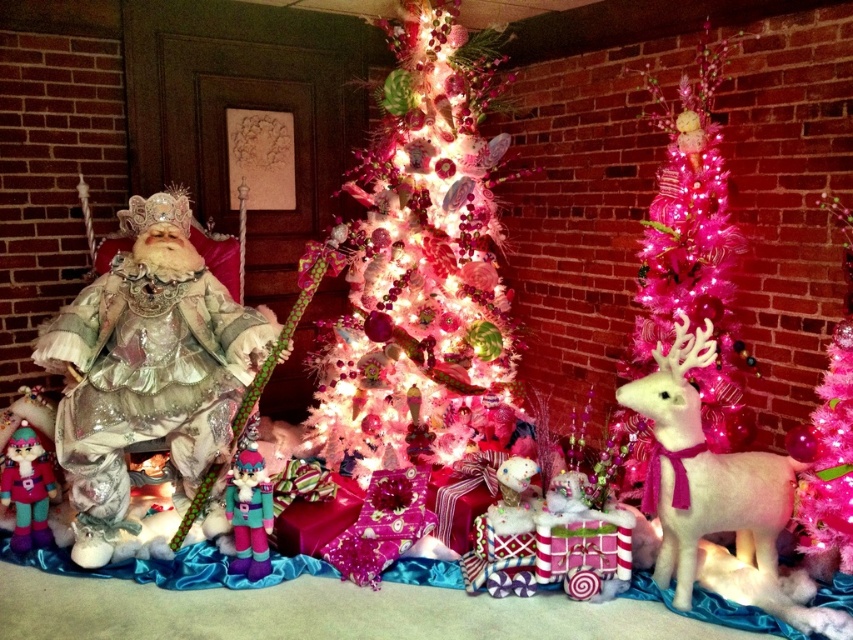
Question: Estimate the real-world distances between objects in this image. Which object is farther from the velvet plush nutcracker at lower left?

Choices:
 (A) shiny silver doll at left
 (B) white glittery christmas tree at center
 (C) pink glittery christmas tree at right

Answer: (C)

Question: Can you confirm if shiny silver doll at left is thinner than pink tinsel christmas tree at right?

Choices:
 (A) yes
 (B) no

Answer: (B)

Question: Is shiny silver doll at left wider than velvet plush nutcracker at lower left?

Choices:
 (A) yes
 (B) no

Answer: (A)

Question: Estimate the real-world distances between objects in this image. Which object is farther from the velvet plush nutcracker at lower left?

Choices:
 (A) pink tinsel christmas tree at right
 (B) pink glittery christmas tree at right
 (C) white felt reindeer at right
 (D) white glittery christmas tree at center

Answer: (B)

Question: Observing the image, what is the correct spatial positioning of white glittery christmas tree at center in reference to pink glittery christmas tree at right?

Choices:
 (A) below
 (B) above

Answer: (B)

Question: Which point is closer to the camera taking this photo?

Choices:
 (A) (15, 432)
 (B) (254, 336)
 (C) (344, 470)

Answer: (A)